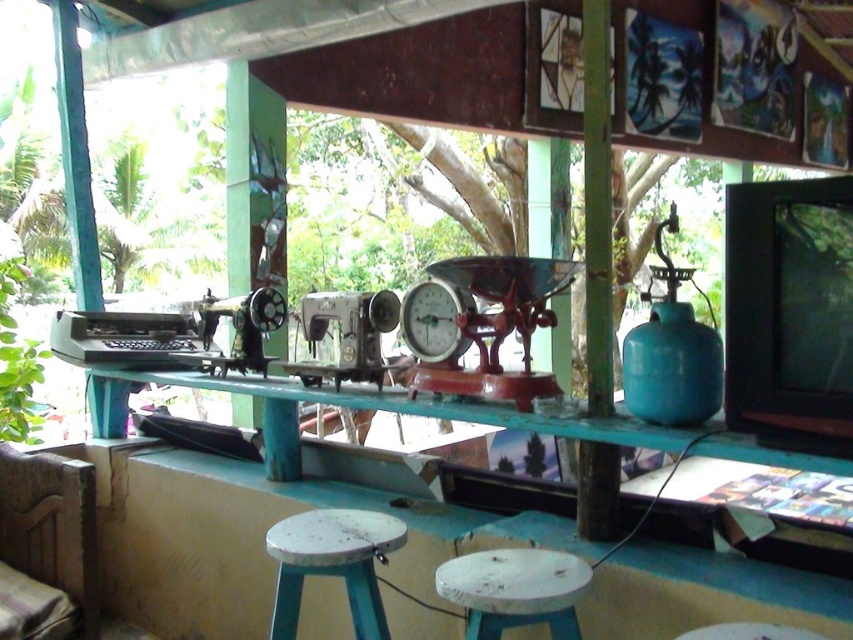
Does white painted wood stool at lower center appear on the left side of matte plastic clock at center?

No, white painted wood stool at lower center is not to the left of matte plastic clock at center.

Between white painted wood stool at lower center and matte plastic clock at center, which one appears on the right side from the viewer's perspective?

From the viewer's perspective, white painted wood stool at lower center appears more on the right side.

You are a GUI agent. You are given a task and a screenshot of the screen. Output one action in this format:
    pyautogui.click(x=<x>, y=<y>)
    Task: Click on the white painted wood stool at lower center
    This screenshot has height=640, width=853.
    Given the screenshot: What is the action you would take?
    pyautogui.click(x=515, y=589)

At what (x,y) coordinates should I click in order to perform the action: click on white painted wood stool at lower center. Please return your answer as a coordinate pair (x, y). The image size is (853, 640). Looking at the image, I should click on (515, 589).

You are a GUI agent. You are given a task and a screenshot of the screen. Output one action in this format:
    pyautogui.click(x=<x>, y=<y>)
    Task: Click on the green wood pole at center
    
    Given the screenshot: What is the action you would take?
    tap(596, 208)

Between green wood pole at center and matte plastic clock at center, which one is positioned higher?

green wood pole at center is higher up.

I want to click on green wood pole at center, so click(x=596, y=208).

The image size is (853, 640). What are the coordinates of `green wood pole at center` in the screenshot? It's located at (596, 208).

Can you confirm if green wood pole at center is thinner than white painted wood stool at center?

Yes, green wood pole at center is thinner than white painted wood stool at center.

Is point (608, 64) closer to viewer compared to point (341, 524)?

Yes, it is in front of point (341, 524).

Is point (599, 337) farther from viewer compared to point (381, 554)?

Yes, point (599, 337) is farther from viewer.

The height and width of the screenshot is (640, 853). Identify the location of green wood pole at center. (596, 208).